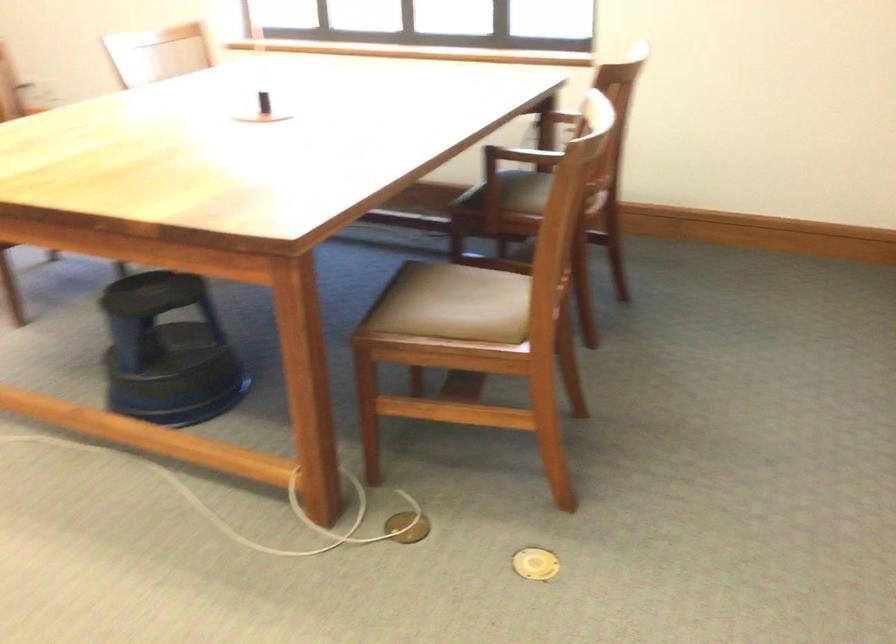
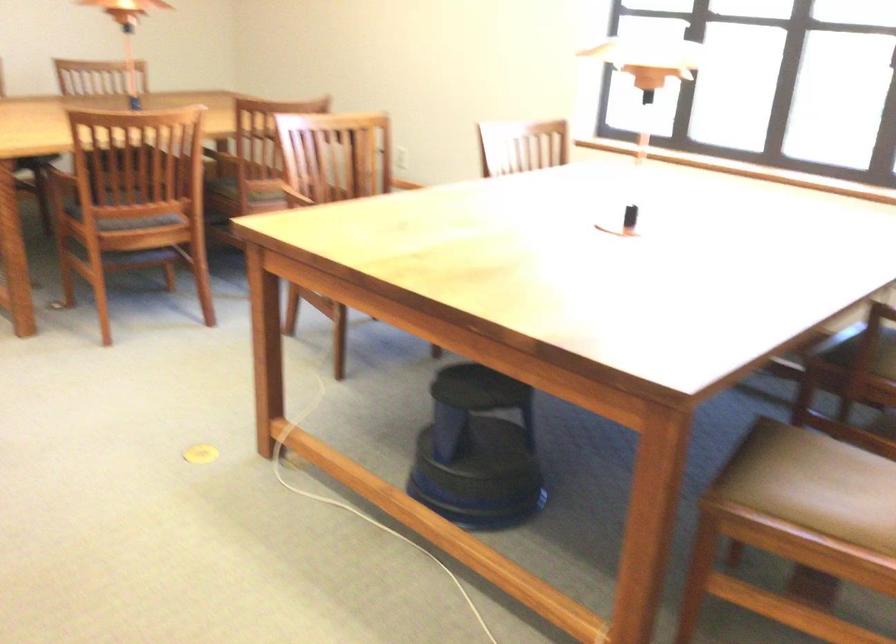
In the second image, find the point that corresponds to pixel 164 354 in the first image.

(478, 451)